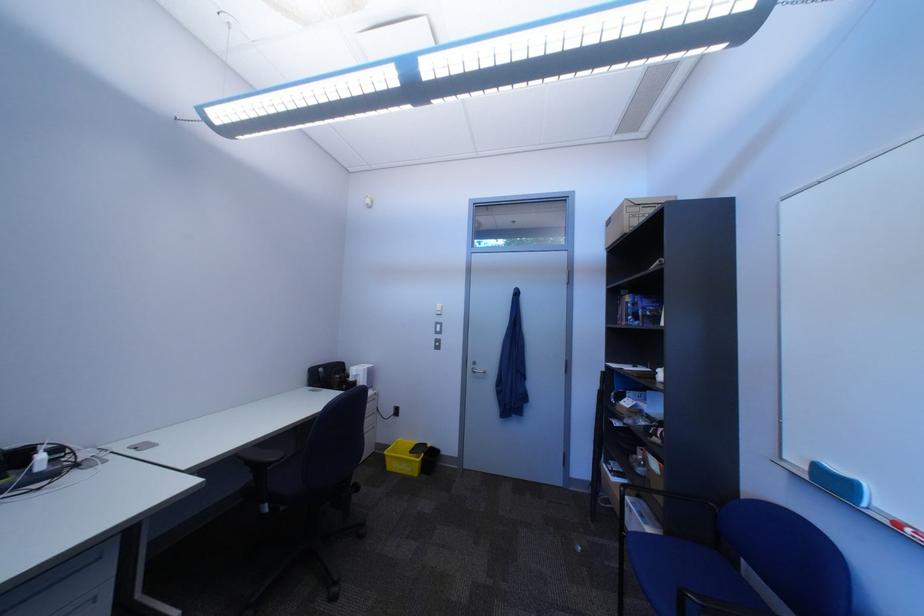
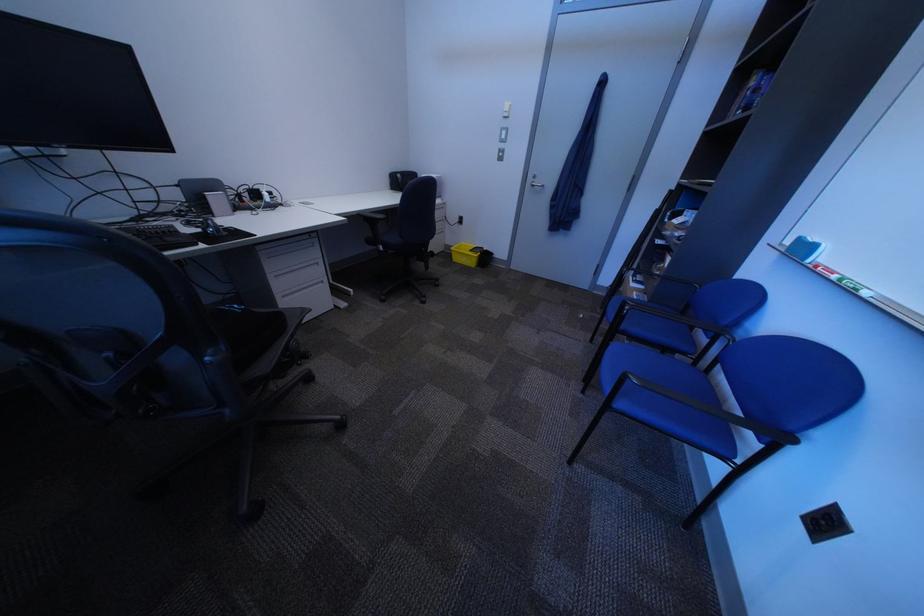
Find the pixel in the second image that matches [407,468] in the first image.

(470, 261)